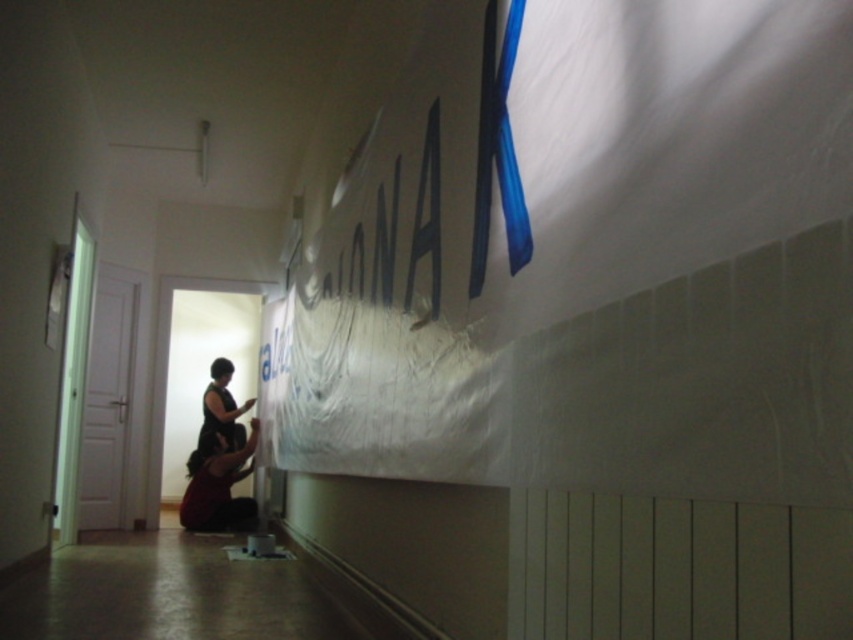
Question: Which object is closer to the camera taking this photo?

Choices:
 (A) dark red fabric at lower center
 (B) dark brown fabric dress at center

Answer: (A)

Question: Does dark red fabric at lower center come in front of dark brown fabric dress at center?

Choices:
 (A) no
 (B) yes

Answer: (B)

Question: Among these points, which one is farthest from the camera?

Choices:
 (A) (213, 410)
 (B) (178, 508)

Answer: (B)

Question: Is dark red fabric at lower center bigger than dark brown fabric dress at center?

Choices:
 (A) yes
 (B) no

Answer: (A)

Question: Considering the relative positions of dark red fabric at lower center and dark brown fabric dress at center in the image provided, where is dark red fabric at lower center located with respect to dark brown fabric dress at center?

Choices:
 (A) left
 (B) right

Answer: (B)

Question: Which of the following is the closest to the observer?

Choices:
 (A) (206, 400)
 (B) (242, 509)

Answer: (B)